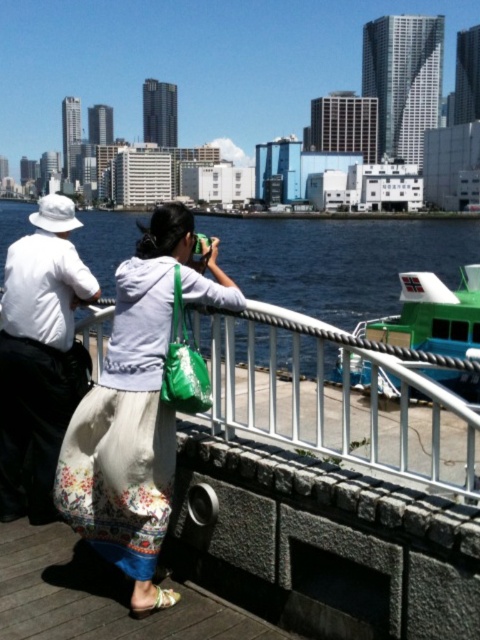
You are standing at the waterfront and want to reach the point marked as point [433,220]. If your walking speed is 1.5 meters per second, how many seconds will it take you to reach that point?

The point [433,220] is 139.53 meters away from the viewer. At a walking speed of 1.5 meters per second, it would take approximately 93 seconds to reach the point.

You are a photographer aiming to capture the entire scene of the white cotton skirt at center and the blue water at center in one shot. Considering their sizes, which object should you focus on to ensure both are visible without cropping?

The white cotton skirt at center is smaller than the blue water at center. To capture both in one shot without cropping, focus on the blue water at center as it occupies more space, allowing the smaller white cotton skirt at center to be included naturally.